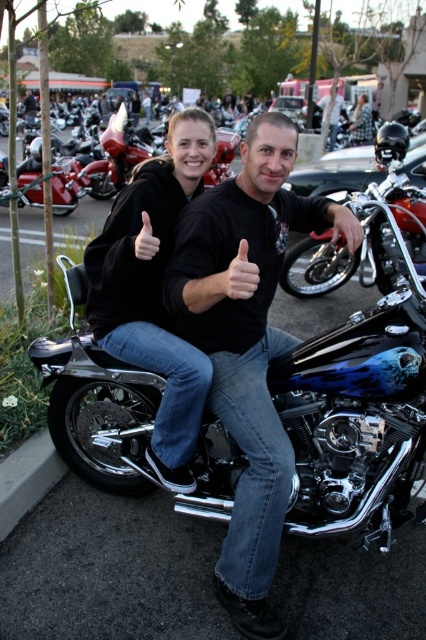
You are standing in front of the motorcycle gathering scene. You notice two points marked in the image. The first point is at coordinate (28,476) and the second is at (337,124). Which point is nearer to you?

Point (28,476) is closer to the viewer than point (337,124).

You are a photographer trying to capture a photo of the black matte shirt at center and the gray concrete curb at lower left. Which object should you focus on first if you want to ensure both are in sharp focus, considering their sizes in the frame?

The black matte shirt at center is taller than the gray concrete curb at lower left, so focusing on the black matte shirt at center first would help ensure both are in sharp focus as it is larger in the frame.